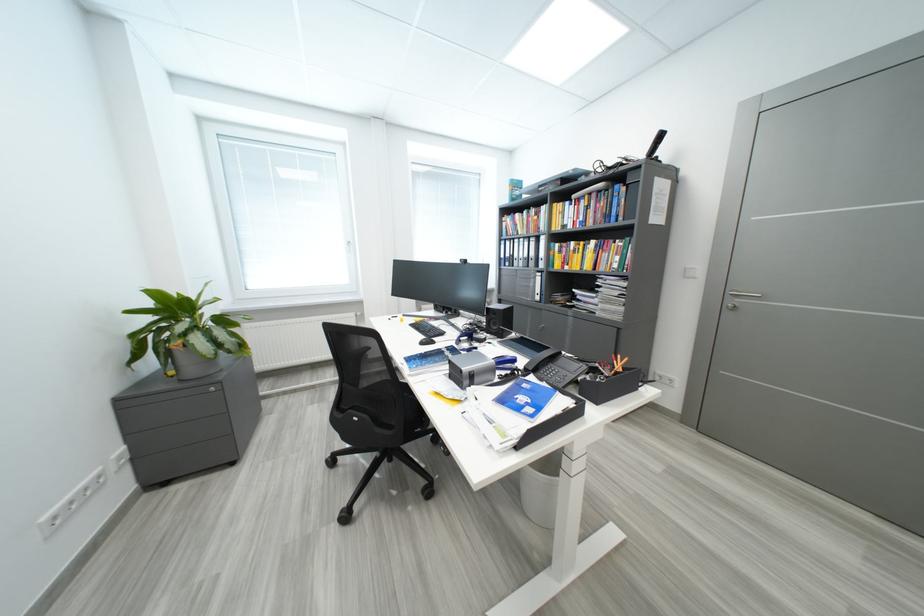
Where would you sit the chair sitting surface? Please return your answer as a coordinate pair (x, y).

(391, 406)